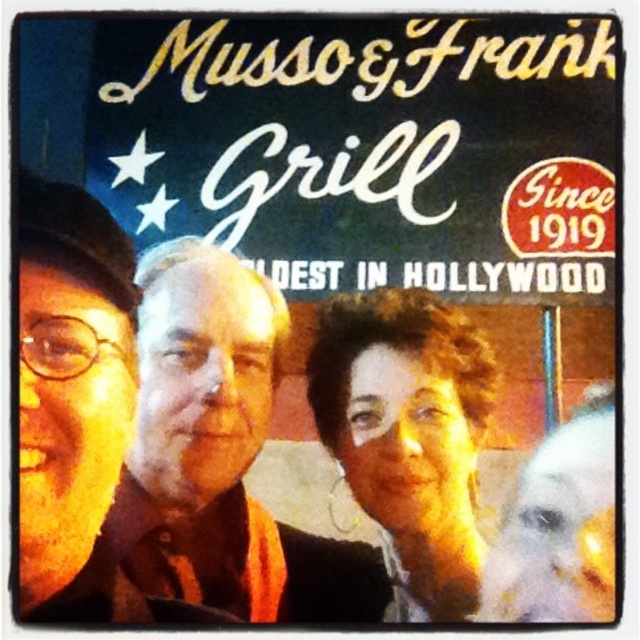
Question: Among these objects, which one is farthest from the camera?

Choices:
 (A) smooth brown shirt at center
 (B) matte black glasses at left
 (C) curly hair at center

Answer: (A)

Question: Estimate the real-world distances between objects in this image. Which object is closer to the curly hair at center?

Choices:
 (A) smooth brown shirt at center
 (B) matte black glasses at left

Answer: (A)

Question: Which point appears closest to the camera in this image?

Choices:
 (A) (19, 481)
 (B) (364, 456)

Answer: (A)

Question: Does smooth brown shirt at center have a lesser width compared to curly hair at center?

Choices:
 (A) yes
 (B) no

Answer: (B)

Question: Is matte black glasses at left in front of curly hair at center?

Choices:
 (A) yes
 (B) no

Answer: (B)

Question: Is the position of smooth brown shirt at center more distant than that of curly hair at center?

Choices:
 (A) yes
 (B) no

Answer: (A)